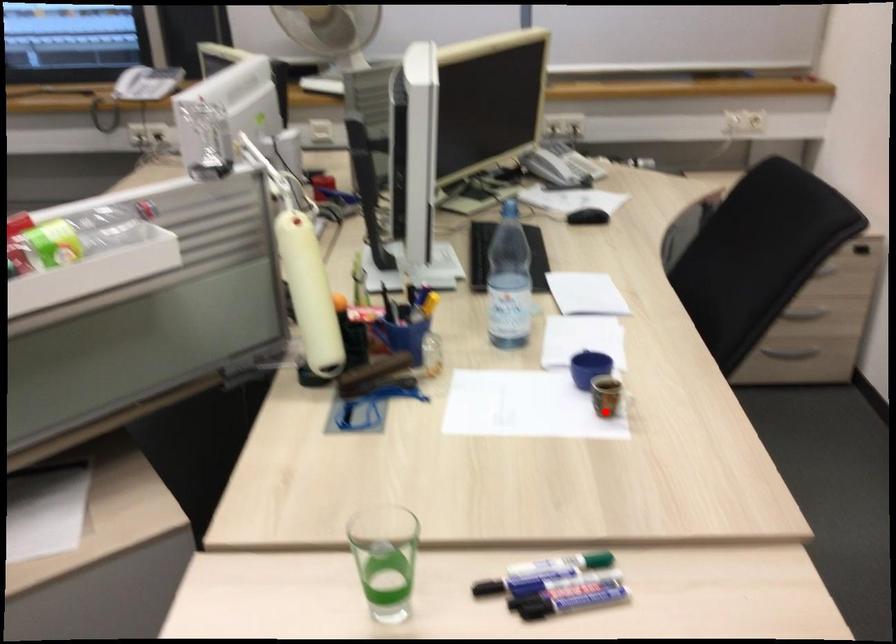
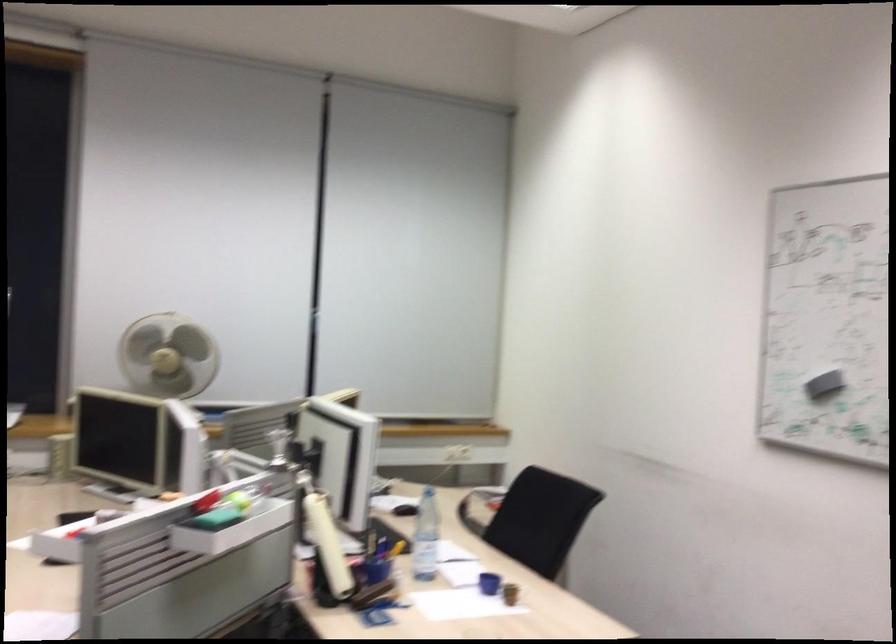
Question: I am providing you with two images of the same scene from different viewpoints. A red point is shown in image1. For the corresponding object point in image2, is it positioned nearer or farther from the camera?

Choices:
 (A) Nearer
 (B) Farther

Answer: (B)